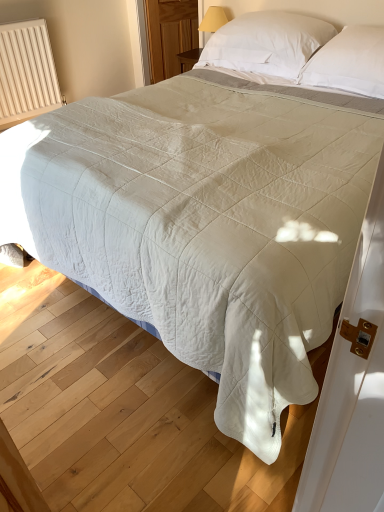
Question: Would you consider transparent wooden door at upper center to be distant from beige ribbed radiator at left?

Choices:
 (A) yes
 (B) no

Answer: (A)

Question: From the image's perspective, is transparent wooden door at upper center under beige ribbed radiator at left?

Choices:
 (A) no
 (B) yes

Answer: (A)

Question: Considering the relative sizes of transparent wooden door at upper center and beige ribbed radiator at left in the image provided, is transparent wooden door at upper center shorter than beige ribbed radiator at left?

Choices:
 (A) no
 (B) yes

Answer: (B)

Question: Is transparent wooden door at upper center further to camera compared to beige ribbed radiator at left?

Choices:
 (A) yes
 (B) no

Answer: (A)

Question: Is beige ribbed radiator at left at the back of transparent wooden door at upper center?

Choices:
 (A) yes
 (B) no

Answer: (B)

Question: Is point (241, 23) positioned closer to the camera than point (152, 4)?

Choices:
 (A) closer
 (B) farther

Answer: (A)

Question: Based on their positions, is white soft pillow at upper center, acting as the first pillow starting from the left, located to the left or right of transparent wooden door at upper center?

Choices:
 (A) left
 (B) right

Answer: (B)

Question: In terms of size, does white soft pillow at upper center, acting as the first pillow starting from the left, appear bigger or smaller than transparent wooden door at upper center?

Choices:
 (A) small
 (B) big

Answer: (B)

Question: Relative to transparent wooden door at upper center, is white soft pillow at upper center, arranged as the 2th pillow when viewed from the right, in front or behind?

Choices:
 (A) front
 (B) behind

Answer: (A)

Question: Considering the positions of transparent wooden door at upper center and white soft pillow at upper center, acting as the first pillow starting from the left, in the image, is transparent wooden door at upper center taller or shorter than white soft pillow at upper center, acting as the first pillow starting from the left,?

Choices:
 (A) short
 (B) tall

Answer: (B)

Question: From a real-world perspective, is transparent wooden door at upper center physically located above or below white soft pillow at upper center, arranged as the 2th pillow when viewed from the right?

Choices:
 (A) above
 (B) below

Answer: (B)

Question: Based on their positions, is transparent wooden door at upper center located to the left or right of white soft pillow at upper center, acting as the first pillow starting from the left?

Choices:
 (A) left
 (B) right

Answer: (A)

Question: Which is correct: transparent wooden door at upper center is inside white soft pillow at upper center, acting as the first pillow starting from the left, or outside of it?

Choices:
 (A) inside
 (B) outside

Answer: (B)

Question: From a real-world perspective, is white soft pillow at upper center, positioned as the first pillow in right-to-left order, above or below beige ribbed radiator at left?

Choices:
 (A) below
 (B) above

Answer: (B)

Question: Considering the positions of white soft pillow at upper center, positioned as the first pillow in right-to-left order, and beige ribbed radiator at left in the image, is white soft pillow at upper center, positioned as the first pillow in right-to-left order, wider or thinner than beige ribbed radiator at left?

Choices:
 (A) wide
 (B) thin

Answer: (A)